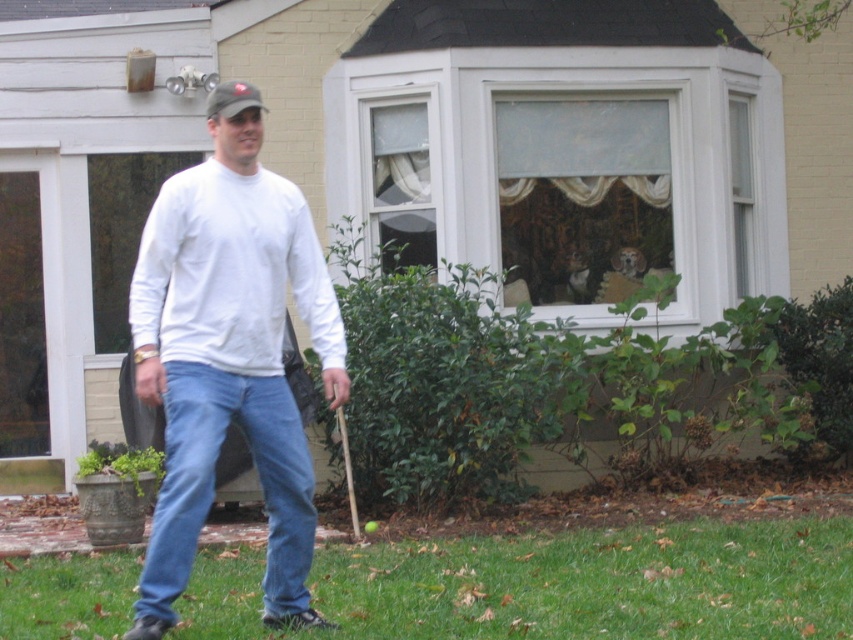
Is green grass at lower center shorter than blue denim jeans at lower center?

Correct, green grass at lower center is not as tall as blue denim jeans at lower center.

In the scene shown: Who is more distant from viewer, (601, 628) or (190, 536)?

Positioned behind is point (601, 628).

Locate an element on the screen. green grass at lower center is located at coordinates (x=596, y=584).

Can you confirm if white cotton shirt at center is smaller than blue denim jeans at lower center?

Actually, white cotton shirt at center might be larger than blue denim jeans at lower center.

Does point (283, 250) lie in front of point (161, 554)?

No, it is behind (161, 554).

Between point (227, 195) and point (270, 401), which one is positioned behind?

Positioned behind is point (270, 401).

Where is `white cotton shirt at center`? white cotton shirt at center is located at coordinates (230, 355).

Consider the image. Is green grass at lower center behind white cotton shirt at center?

Yes, it is.

What do you see at coordinates (596, 584) in the screenshot? This screenshot has height=640, width=853. I see `green grass at lower center` at bounding box center [596, 584].

You are a GUI agent. You are given a task and a screenshot of the screen. Output one action in this format:
    pyautogui.click(x=<x>, y=<y>)
    Task: Click on the green grass at lower center
    
    Given the screenshot: What is the action you would take?
    pyautogui.click(x=596, y=584)

Find the location of a particular element. green grass at lower center is located at coordinates (596, 584).